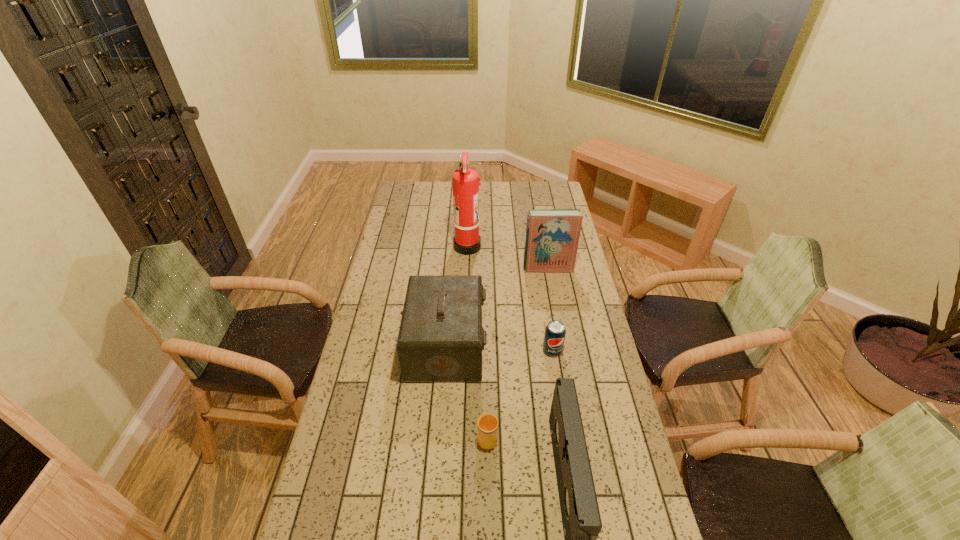
At what (x,y) coordinates should I click in order to perform the action: click on the farthest object. Please return your answer as a coordinate pair (x, y). Looking at the image, I should click on (466, 241).

Find the location of `fire extinguisher`. fire extinguisher is located at coordinates (466, 241).

The height and width of the screenshot is (540, 960). In order to click on hardback book in this screenshot , I will do `click(552, 235)`.

Locate an element on the screen. This screenshot has height=540, width=960. the fifth shortest object is located at coordinates (552, 235).

Locate an element on the screen. The height and width of the screenshot is (540, 960). the first-aid kit is located at coordinates (441, 338).

Image resolution: width=960 pixels, height=540 pixels. Identify the location of soda can. point(554,337).

I want to click on cup, so click(487, 423).

At what (x,y) coordinates should I click in order to perform the action: click on free space located at the nozzle of the fire extinguisher. Please return your answer as a coordinate pair (x, y). Looking at the image, I should click on (534, 245).

Find the location of a particular element. vacant region located 0.330m on the cover of the fifth nearest object is located at coordinates (559, 329).

You are a GUI agent. You are given a task and a screenshot of the screen. Output one action in this format:
    pyautogui.click(x=<x>, y=<y>)
    Task: Click on the vacant space positioned 0.220m on the back of the first-aid kit
    This screenshot has height=540, width=960.
    Given the screenshot: What is the action you would take?
    pyautogui.click(x=451, y=277)